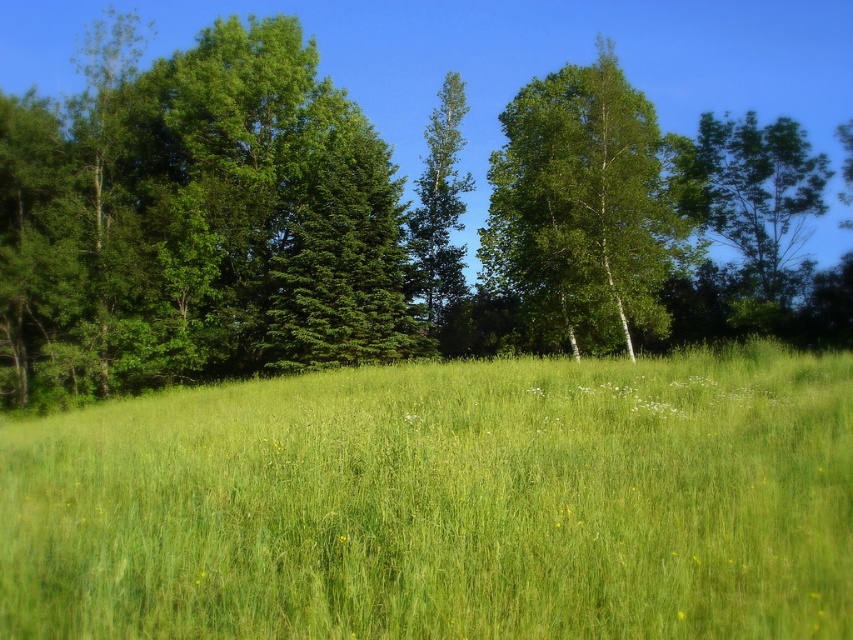
Between green leafy tree at upper center and green leafy tree at center, which one has more height?

green leafy tree at upper center

Can you confirm if green leafy tree at upper center is shorter than green leafy tree at center?

Incorrect, green leafy tree at upper center's height does not fall short of green leafy tree at center's.

Measure the distance between green leafy tree at upper center and camera.

They are 26.56 meters apart.

Locate an element on the screen. This screenshot has width=853, height=640. green leafy tree at upper center is located at coordinates (373, 221).

Consider the image. Is green leafy tree at upper center taller than green leafy tree at upper right?

Correct, green leafy tree at upper center is much taller as green leafy tree at upper right.

Between green leafy tree at upper center and green leafy tree at upper right, which one has less height?

With less height is green leafy tree at upper right.

Describe the element at coordinates (373, 221) in the screenshot. I see `green leafy tree at upper center` at that location.

Identify the location of green leafy tree at upper center. (373, 221).

The width and height of the screenshot is (853, 640). What do you see at coordinates (751, 230) in the screenshot? I see `green leafy tree at upper right` at bounding box center [751, 230].

Does point (715, 138) lie behind point (428, 173)?

No, it is in front of (428, 173).

At what (x,y) coordinates should I click in order to perform the action: click on green leafy tree at upper right. Please return your answer as a coordinate pair (x, y). The image size is (853, 640). Looking at the image, I should click on (751, 230).